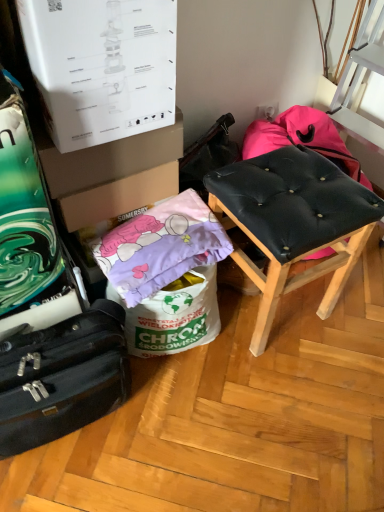
The image size is (384, 512). Describe the element at coordinates (108, 158) in the screenshot. I see `brown cardboard box at upper left, which is counted as the first cardboard box, starting from the top` at that location.

In order to click on brown cardboard box at center, the 1th cardboard box positioned from the bottom in this screenshot , I will do `click(118, 196)`.

Does purple fabric pillow at lower left lie in front of black leather stool at right?

No, it is behind black leather stool at right.

How different are the orientations of purple fabric pillow at lower left and black leather stool at right in degrees?

1.92 degrees separate the facing orientations of purple fabric pillow at lower left and black leather stool at right.

Is purple fabric pillow at lower left located outside black leather stool at right?

That's correct, purple fabric pillow at lower left is outside of black leather stool at right.

Consider the image. Does purple fabric pillow at lower left have a lesser width compared to black leather stool at right?

Indeed, purple fabric pillow at lower left has a lesser width compared to black leather stool at right.

Looking at the image, does brown cardboard box at center, the 1th cardboard box positioned from the bottom, seem bigger or smaller compared to black fabric suitcase at lower left?

Answer: In the image, brown cardboard box at center, the 1th cardboard box positioned from the bottom, appears to be smaller than black fabric suitcase at lower left.

Which object is positioned more to the right, brown cardboard box at center, marked as the 2th cardboard box in a top-to-bottom arrangement, or black fabric suitcase at lower left?

brown cardboard box at center, marked as the 2th cardboard box in a top-to-bottom arrangement.

Locate an element on the screen. the 2nd cardboard box behind when counting from the black fabric suitcase at lower left is located at coordinates (118, 196).

Is brown cardboard box at center, marked as the 2th cardboard box in a top-to-bottom arrangement, not inside black fabric suitcase at lower left?

brown cardboard box at center, marked as the 2th cardboard box in a top-to-bottom arrangement, is positioned outside black fabric suitcase at lower left.

Do you think brown cardboard box at center, the 1th cardboard box positioned from the bottom, is within black leather stool at right, or outside of it?

brown cardboard box at center, the 1th cardboard box positioned from the bottom, cannot be found inside black leather stool at right.

Which of these two, brown cardboard box at center, the 1th cardboard box positioned from the bottom, or black leather stool at right, stands shorter?

Standing shorter between the two is brown cardboard box at center, the 1th cardboard box positioned from the bottom.

Based on the photo, considering the sizes of objects brown cardboard box at center, marked as the 2th cardboard box in a top-to-bottom arrangement, and black leather stool at right in the image provided, who is wider, brown cardboard box at center, marked as the 2th cardboard box in a top-to-bottom arrangement, or black leather stool at right?

black leather stool at right is wider.

Considering the points (156, 178) and (329, 179), which point is behind, point (156, 178) or point (329, 179)?

The point (156, 178) is farther.

From their relative heights in the image, would you say purple fabric pillow at lower left is taller or shorter than black fabric suitcase at lower left?

Considering their sizes, purple fabric pillow at lower left has less height than black fabric suitcase at lower left.

From the image's perspective, is purple fabric pillow at lower left on black fabric suitcase at lower left?

Yes.

Is purple fabric pillow at lower left next to black fabric suitcase at lower left?

No, purple fabric pillow at lower left is not touching black fabric suitcase at lower left.

Looking at the image, does black leather stool at right seem bigger or smaller compared to black fabric suitcase at lower left?

Considering their sizes, black leather stool at right takes up more space than black fabric suitcase at lower left.

Which is more to the right, black leather stool at right or black fabric suitcase at lower left?

From the viewer's perspective, black leather stool at right appears more on the right side.

From a real-world perspective, is black leather stool at right beneath black fabric suitcase at lower left?

No, from a real-world perspective, black leather stool at right is not under black fabric suitcase at lower left.

Is point (324, 196) farther from camera compared to point (90, 367)?

Yes, point (324, 196) is behind point (90, 367).

How much distance is there between black fabric suitcase at lower left and brown cardboard box at upper left, acting as the second cardboard box starting from the bottom?

black fabric suitcase at lower left is 16.28 inches from brown cardboard box at upper left, acting as the second cardboard box starting from the bottom.

How different are the orientations of black fabric suitcase at lower left and brown cardboard box at upper left, which is counted as the first cardboard box, starting from the top, in degrees?

The angle between the facing direction of black fabric suitcase at lower left and the facing direction of brown cardboard box at upper left, which is counted as the first cardboard box, starting from the top, is 5.49 degrees.

In order to click on suitcase that is on the left side of brown cardboard box at upper left, which is counted as the first cardboard box, starting from the top in this screenshot , I will do `click(63, 378)`.

Is black fabric suitcase at lower left not within brown cardboard box at upper left, which is counted as the first cardboard box, starting from the top?

That's correct, black fabric suitcase at lower left is outside of brown cardboard box at upper left, which is counted as the first cardboard box, starting from the top.

Considering the sizes of objects black fabric suitcase at lower left and brown cardboard box at center, the 1th cardboard box positioned from the bottom, in the image provided, who is wider, black fabric suitcase at lower left or brown cardboard box at center, the 1th cardboard box positioned from the bottom,?

Wider between the two is brown cardboard box at center, the 1th cardboard box positioned from the bottom.

Can you tell me how much black fabric suitcase at lower left and brown cardboard box at center, the 1th cardboard box positioned from the bottom, differ in facing direction?

They differ by 5.49 degrees in their facing directions.

From a real-world perspective, is black fabric suitcase at lower left positioned above or below brown cardboard box at center, marked as the 2th cardboard box in a top-to-bottom arrangement?

Clearly, from a real-world perspective, black fabric suitcase at lower left is below brown cardboard box at center, marked as the 2th cardboard box in a top-to-bottom arrangement.

From the picture: From the image's perspective, is black fabric suitcase at lower left under brown cardboard box at center, the 1th cardboard box positioned from the bottom?

Yes.

Locate an element on the screen. This screenshot has width=384, height=512. material on the left of black leather stool at right is located at coordinates (161, 246).

From the black fabric suitcase at lower left, count 2nd cardboard boxs backward and point to it. Please provide its 2D coordinates.

[(118, 196)]

Based on their spatial positions, is brown cardboard box at center, marked as the 2th cardboard box in a top-to-bottom arrangement, or purple fabric pillow at lower left further from brown cardboard box at upper left, acting as the second cardboard box starting from the bottom?

purple fabric pillow at lower left is positioned further to the anchor brown cardboard box at upper left, acting as the second cardboard box starting from the bottom.

Which object lies further to the anchor point purple fabric pillow at lower left, brown cardboard box at upper left, which is counted as the first cardboard box, starting from the top, or black leather stool at right?

black leather stool at right is positioned further to the anchor purple fabric pillow at lower left.

Based on their spatial positions, is purple fabric pillow at lower left or black leather stool at right closer to brown cardboard box at center, marked as the 2th cardboard box in a top-to-bottom arrangement?

purple fabric pillow at lower left.

Estimate the real-world distances between objects in this image. Which object is closer to purple fabric pillow at lower left, black fabric suitcase at lower left or brown cardboard box at center, marked as the 2th cardboard box in a top-to-bottom arrangement?

brown cardboard box at center, marked as the 2th cardboard box in a top-to-bottom arrangement, lies closer to purple fabric pillow at lower left than the other object.

Estimate the real-world distances between objects in this image. Which object is further from black fabric suitcase at lower left, brown cardboard box at center, marked as the 2th cardboard box in a top-to-bottom arrangement, or purple fabric pillow at lower left?

The object further to black fabric suitcase at lower left is brown cardboard box at center, marked as the 2th cardboard box in a top-to-bottom arrangement.

Which object lies further to the anchor point black leather stool at right, purple fabric pillow at lower left or black fabric suitcase at lower left?

Among the two, black fabric suitcase at lower left is located further to black leather stool at right.

When comparing their distances from purple fabric pillow at lower left, does brown cardboard box at upper left, acting as the second cardboard box starting from the bottom, or black fabric suitcase at lower left seem closer?

brown cardboard box at upper left, acting as the second cardboard box starting from the bottom, is closer to purple fabric pillow at lower left.

Looking at the image, which one is located closer to black leather stool at right, brown cardboard box at upper left, acting as the second cardboard box starting from the bottom, or black fabric suitcase at lower left?

brown cardboard box at upper left, acting as the second cardboard box starting from the bottom.

Identify the location of material between brown cardboard box at upper left, acting as the second cardboard box starting from the bottom, and black fabric suitcase at lower left vertically. This screenshot has width=384, height=512. (161, 246).

This screenshot has width=384, height=512. Identify the location of cardboard box between brown cardboard box at upper left, which is counted as the first cardboard box, starting from the top, and black leather stool at right from left to right. (118, 196).

Image resolution: width=384 pixels, height=512 pixels. I want to click on cardboard box between brown cardboard box at upper left, which is counted as the first cardboard box, starting from the top, and black fabric suitcase at lower left vertically, so click(118, 196).

Where is `material between brown cardboard box at center, the 1th cardboard box positioned from the bottom, and black leather stool at right, in the horizontal direction`? This screenshot has height=512, width=384. material between brown cardboard box at center, the 1th cardboard box positioned from the bottom, and black leather stool at right, in the horizontal direction is located at coordinates (161, 246).